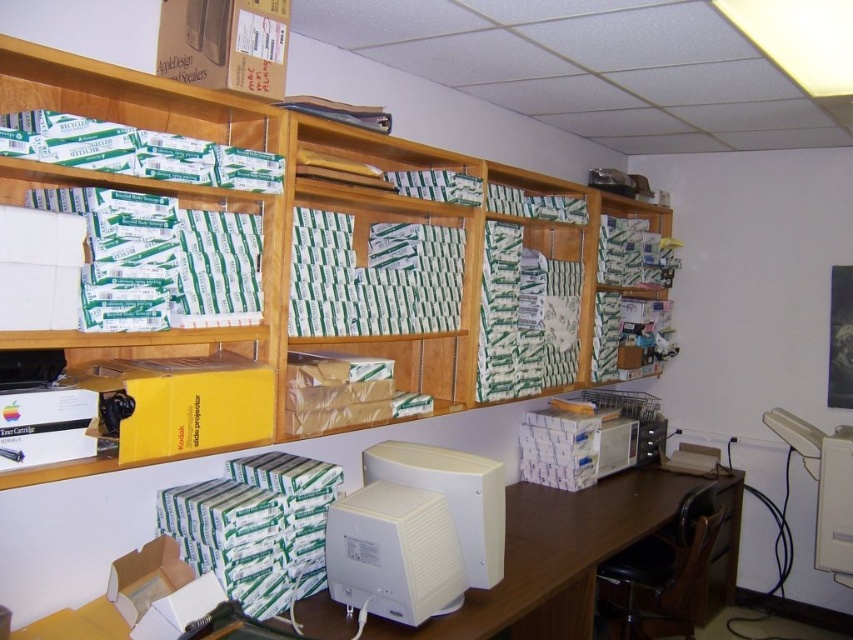
In the scene shown: You are organizing items in the office and need to move the white plastic computer desk at center and the cardboard box at upper left. Based on their positions, which object is located more to the left?

The cardboard box at upper left is more to the left since the white plastic computer desk at center is to the right of it.

You are organizing the office and need to move the white plastic monitor at center. Since the wooden shelves at upper center are above it, could moving the monitor cause items on the shelves to fall?

The wooden shelves at upper center are above the white plastic monitor at center, so moving the monitor might risk items falling from the shelves if they are not secured properly.

You are organizing items in the office and need to place a new box that is 2 feet wide. The wooden shelves at upper center and the white plastic monitor at center are in your way. Which object has enough space to accommodate the box without moving either?

The wooden shelves at upper center has a larger width than the white plastic monitor at center, so the box can fit on the wooden shelves at upper center.